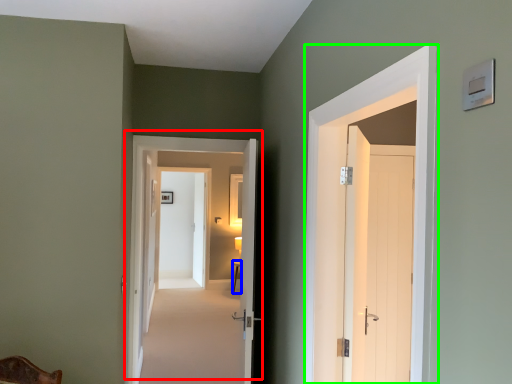
Question: Which is nearer to the door (highlighted by a red box)? table (highlighted by a blue box) or door (highlighted by a green box).

Choices:
 (A) table
 (B) door

Answer: (B)